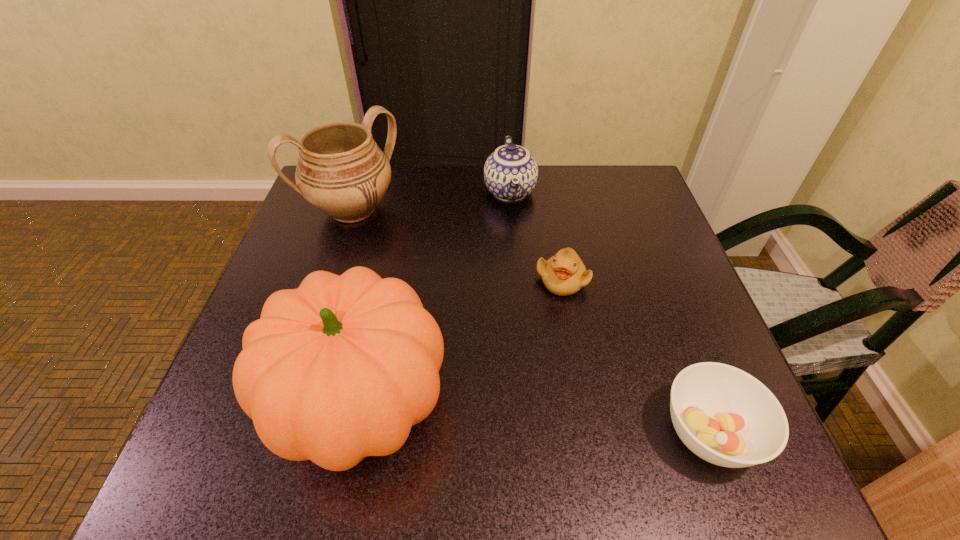
Where is `pumpkin`? pumpkin is located at coordinates (341, 368).

The width and height of the screenshot is (960, 540). I want to click on the rightmost object, so click(x=727, y=417).

I want to click on the third farthest object, so click(x=564, y=274).

Find the location of `chinaware`. chinaware is located at coordinates (510, 173).

Where is `urn`? urn is located at coordinates (341, 171).

Find the location of a particular element. This screenshot has height=540, width=960. free space located 0.240m on the back of the pumpkin is located at coordinates (393, 251).

Locate an element on the screen. vacant region located on the back of the soup bowl is located at coordinates (645, 261).

Locate an element on the screen. vacant space located on the front-facing side of the third farthest object is located at coordinates (555, 363).

Locate an element on the screen. This screenshot has width=960, height=540. vacant region located 0.060m on the front-facing side of the third farthest object is located at coordinates coord(559,321).

At what (x,y) coordinates should I click in order to perform the action: click on free spot located on the front-facing side of the third farthest object. Please return your answer as a coordinate pair (x, y). The width and height of the screenshot is (960, 540). Looking at the image, I should click on (558, 325).